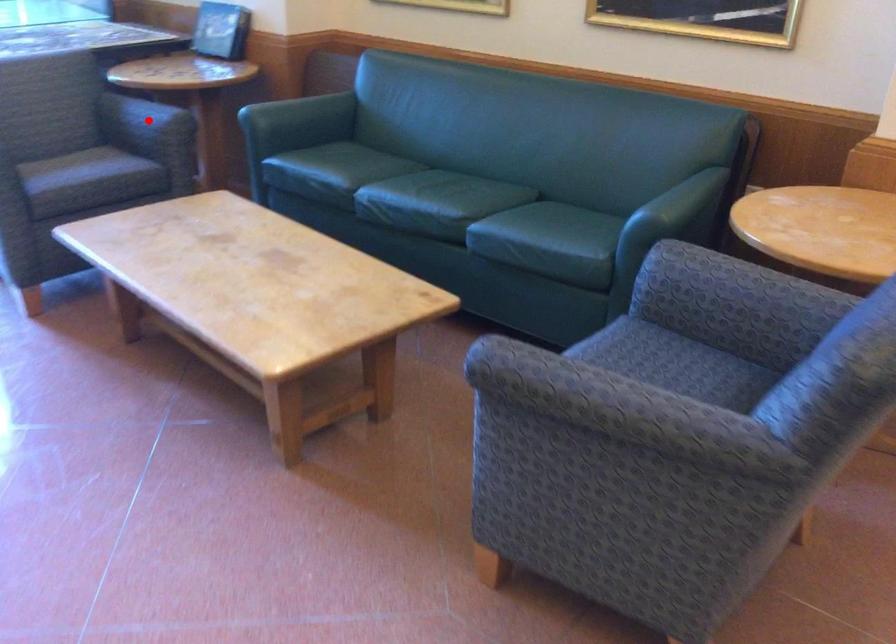
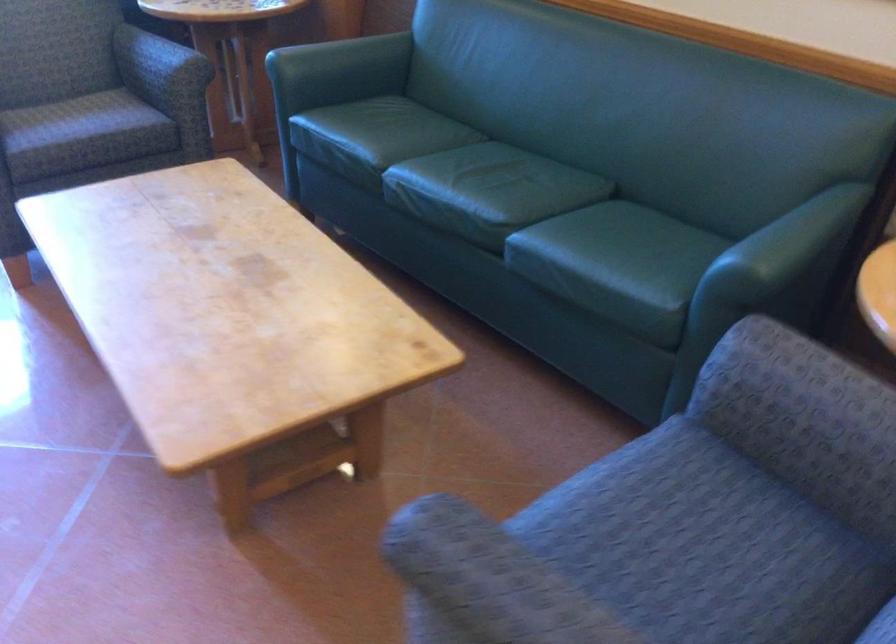
Where in the second image is the point corresponding to the highlighted location from the first image?

(158, 62)